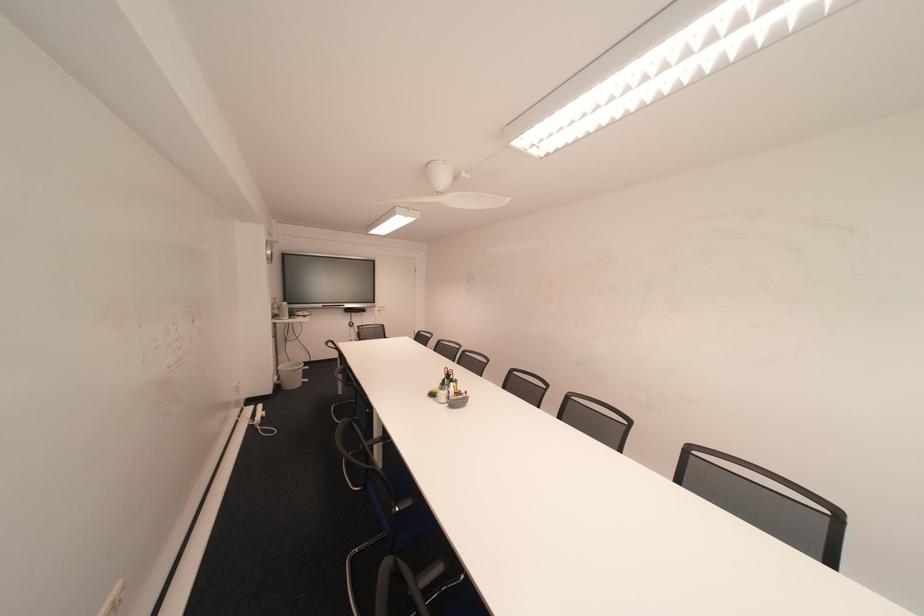
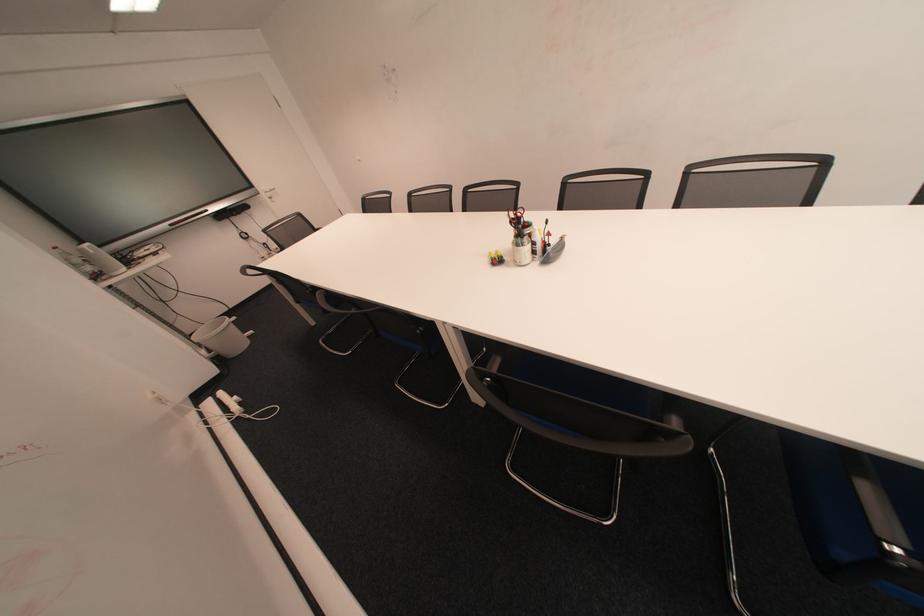
Where in the second image is the point corresponding to (453,390) from the first image?

(529, 245)